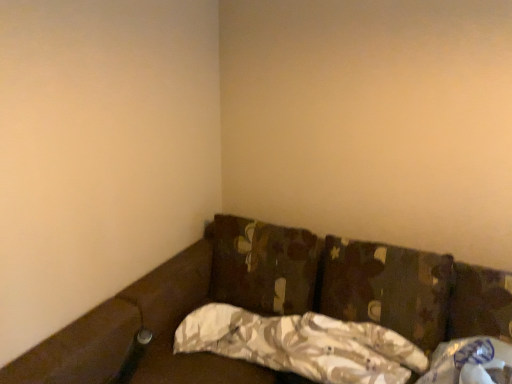
Question: Can you confirm if camouflage fabric pillow at center, acting as the second pillow starting from the left, is positioned to the right of camo fabric pillow at center, the 3th pillow positioned from the left?

Choices:
 (A) no
 (B) yes

Answer: (A)

Question: Considering the relative positions of camouflage fabric pillow at center, which is the second pillow in right-to-left order, and camo fabric pillow at center, the first pillow in the right-to-left sequence, in the image provided, is camouflage fabric pillow at center, which is the second pillow in right-to-left order, to the left of camo fabric pillow at center, the first pillow in the right-to-left sequence, from the viewer's perspective?

Choices:
 (A) no
 (B) yes

Answer: (B)

Question: From a real-world perspective, is camouflage fabric pillow at center, acting as the second pillow starting from the left, beneath camo fabric pillow at center, the first pillow in the right-to-left sequence?

Choices:
 (A) yes
 (B) no

Answer: (A)

Question: Is the depth of camouflage fabric pillow at center, acting as the second pillow starting from the left, less than that of camo fabric pillow at center, the 3th pillow positioned from the left?

Choices:
 (A) yes
 (B) no

Answer: (A)

Question: Is camouflage fabric pillow at center, which is the second pillow in right-to-left order, thinner than camo fabric pillow at center, the first pillow in the right-to-left sequence?

Choices:
 (A) yes
 (B) no

Answer: (B)

Question: Is camouflage fabric pillow at center, acting as the third pillow starting from the right, in front of or behind white plastic bag at lower right in the image?

Choices:
 (A) front
 (B) behind

Answer: (B)

Question: From a real-world perspective, is camouflage fabric pillow at center, acting as the third pillow starting from the right, physically located above or below white plastic bag at lower right?

Choices:
 (A) below
 (B) above

Answer: (B)

Question: Considering the relative positions of camouflage fabric pillow at center, acting as the 1th pillow starting from the left, and white plastic bag at lower right in the image provided, is camouflage fabric pillow at center, acting as the 1th pillow starting from the left, to the left or to the right of white plastic bag at lower right?

Choices:
 (A) right
 (B) left

Answer: (B)

Question: Considering the positions of camouflage fabric pillow at center, acting as the 1th pillow starting from the left, and white plastic bag at lower right in the image, is camouflage fabric pillow at center, acting as the 1th pillow starting from the left, bigger or smaller than white plastic bag at lower right?

Choices:
 (A) small
 (B) big

Answer: (B)

Question: Considering the positions of camouflage fabric pillow at center, which is the second pillow in right-to-left order, and camo fabric pillow at center, the first pillow in the right-to-left sequence, in the image, is camouflage fabric pillow at center, which is the second pillow in right-to-left order, wider or thinner than camo fabric pillow at center, the first pillow in the right-to-left sequence,?

Choices:
 (A) wide
 (B) thin

Answer: (A)

Question: Does point (326, 327) appear closer or farther from the camera than point (449, 291)?

Choices:
 (A) farther
 (B) closer

Answer: (A)

Question: Is camouflage fabric pillow at center, which is the second pillow in right-to-left order, in front of or behind camo fabric pillow at center, the 3th pillow positioned from the left, in the image?

Choices:
 (A) front
 (B) behind

Answer: (A)

Question: Based on their sizes in the image, would you say camouflage fabric pillow at center, acting as the second pillow starting from the left, is bigger or smaller than camo fabric pillow at center, the 3th pillow positioned from the left?

Choices:
 (A) small
 (B) big

Answer: (A)

Question: Based on their positions, is camouflage fabric pillow at center, which is the second pillow in right-to-left order, located to the left or right of white plastic bag at lower right?

Choices:
 (A) left
 (B) right

Answer: (A)

Question: Considering the positions of point (217, 306) and point (451, 380), is point (217, 306) closer or farther from the camera than point (451, 380)?

Choices:
 (A) closer
 (B) farther

Answer: (B)